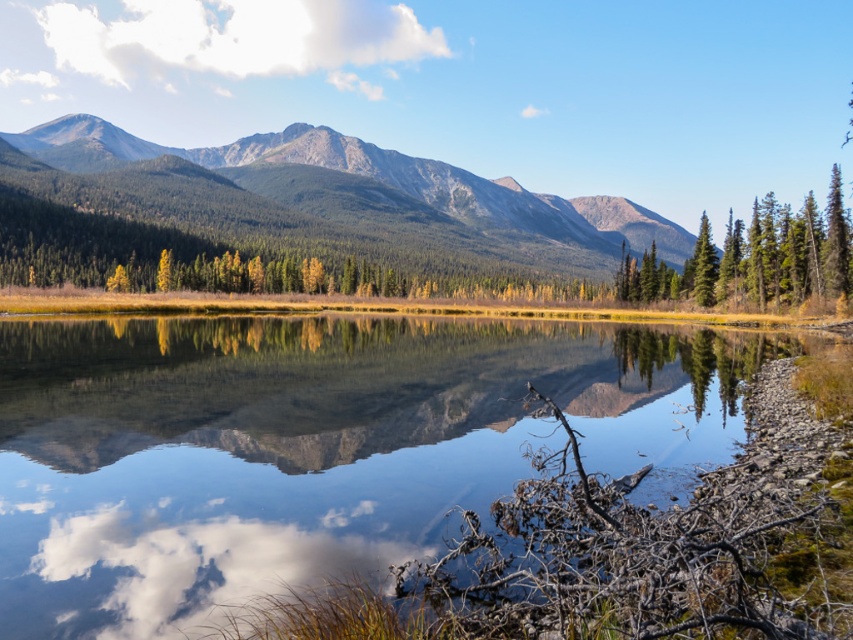
You are an artist sketching this landscape and want to ensure the white fluffy cloud at upper left and the green forested mountain range at upper left are positioned correctly. Which one should you draw first to maintain the scene as seen in the image?

The green forested mountain range at upper left should be drawn first because the white fluffy cloud at upper left is above it, meaning the cloud is closer and should be placed on top of the mountain range in the sketch.

You are standing at the lakeside and want to take a photo of both the clear water at center and the green forested mountain range at upper left. Which object will appear larger in your photo?

The clear water at center will appear larger in the photo because it is closer to the viewer than the green forested mountain range at upper left.